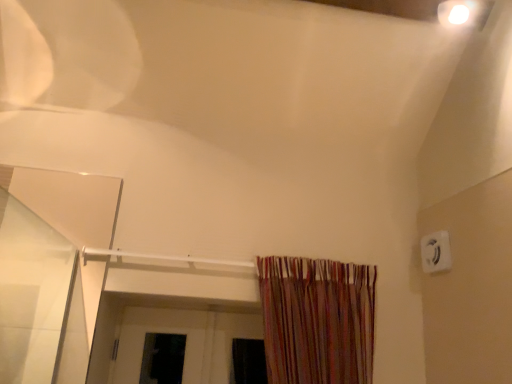
Find the location of a particular element. The height and width of the screenshot is (384, 512). white plastic electric outlet at upper right is located at coordinates (436, 252).

Describe the element at coordinates (436, 252) in the screenshot. Image resolution: width=512 pixels, height=384 pixels. I see `white plastic electric outlet at upper right` at that location.

Image resolution: width=512 pixels, height=384 pixels. I want to click on white plastic electric outlet at upper right, so click(436, 252).